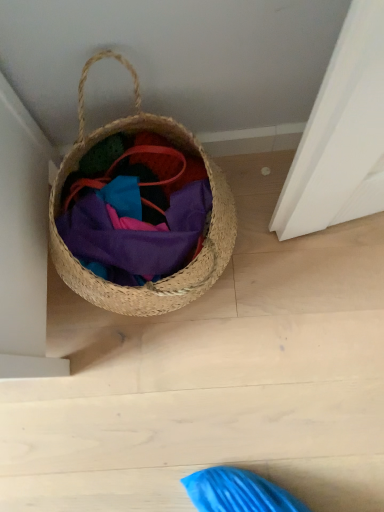
Question: From the image's perspective, does woven straw basket at left appear lower than matte woven basket at center?

Choices:
 (A) no
 (B) yes

Answer: (A)

Question: From a real-world perspective, is woven straw basket at left below matte woven basket at center?

Choices:
 (A) yes
 (B) no

Answer: (B)

Question: Can you confirm if woven straw basket at left is smaller than matte woven basket at center?

Choices:
 (A) no
 (B) yes

Answer: (A)

Question: From the image's perspective, is woven straw basket at left over matte woven basket at center?

Choices:
 (A) yes
 (B) no

Answer: (A)

Question: From a real-world perspective, is woven straw basket at left located higher than matte woven basket at center?

Choices:
 (A) no
 (B) yes

Answer: (B)

Question: Is matte woven basket at center at the back of woven straw basket at left?

Choices:
 (A) yes
 (B) no

Answer: (A)

Question: Is matte woven basket at center smaller than woven straw basket at left?

Choices:
 (A) no
 (B) yes

Answer: (B)

Question: Is matte woven basket at center in front of woven straw basket at left?

Choices:
 (A) yes
 (B) no

Answer: (B)

Question: From a real-world perspective, is matte woven basket at center physically above woven straw basket at left?

Choices:
 (A) no
 (B) yes

Answer: (A)

Question: Is the surface of matte woven basket at center in direct contact with woven straw basket at left?

Choices:
 (A) no
 (B) yes

Answer: (B)

Question: Is matte woven basket at center turned away from woven straw basket at left?

Choices:
 (A) no
 (B) yes

Answer: (B)

Question: From the image's perspective, is matte woven basket at center above woven straw basket at left?

Choices:
 (A) no
 (B) yes

Answer: (A)

Question: Is point (225, 228) closer or farther from the camera than point (200, 198)?

Choices:
 (A) closer
 (B) farther

Answer: (A)